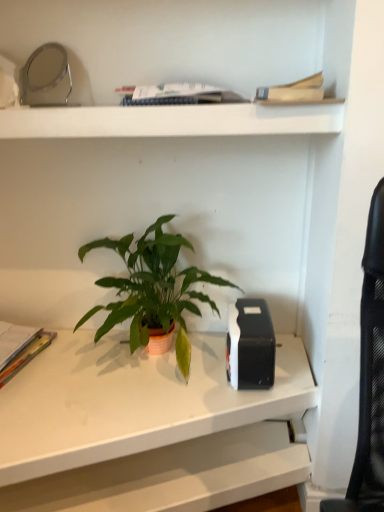
You are a GUI agent. You are given a task and a screenshot of the screen. Output one action in this format:
    pyautogui.click(x=<x>, y=<y>)
    Task: Click on the blank space above white matte desk at center (from a real-world perspective)
    
    Given the screenshot: What is the action you would take?
    pyautogui.click(x=92, y=385)